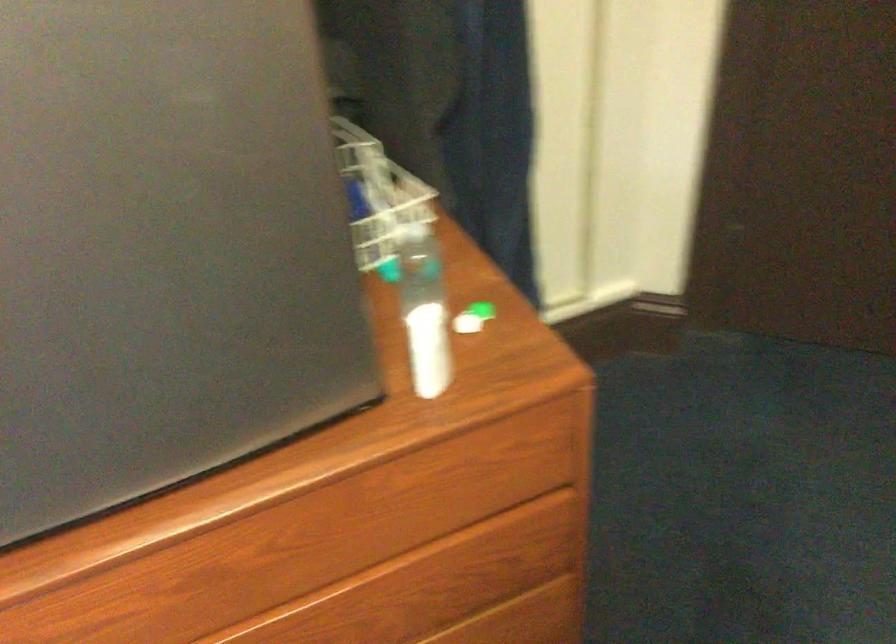
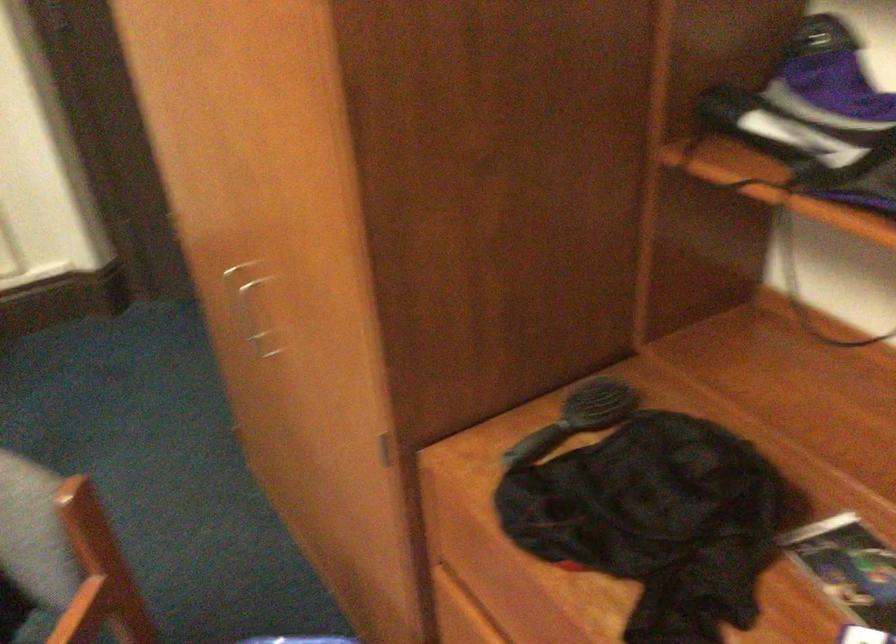
The images are taken continuously from a first-person perspective. In which direction are you moving?

The movement direction of the cameraman is right, backward.